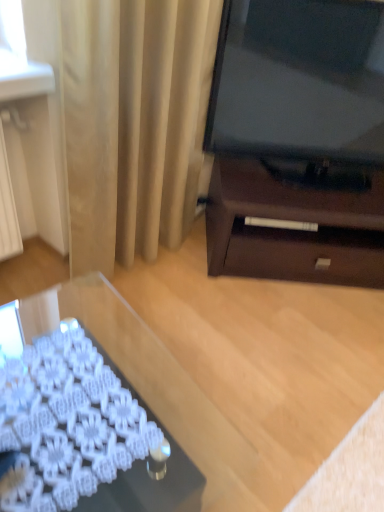
Find the location of a particular element. free space above transparent glass desk at lower left (from a real-world perspective) is located at coordinates (70, 400).